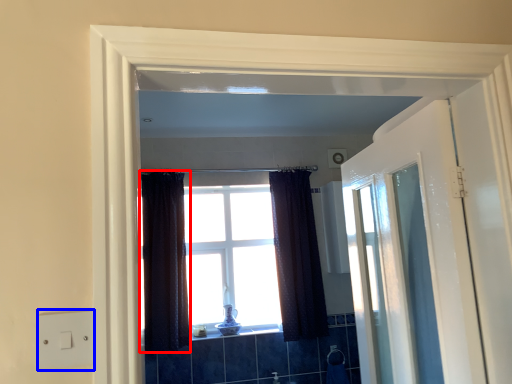
Question: Among these objects, which one is farthest to the camera, curtain (highlighted by a red box) or electric outlet (highlighted by a blue box)?

Choices:
 (A) curtain
 (B) electric outlet

Answer: (A)